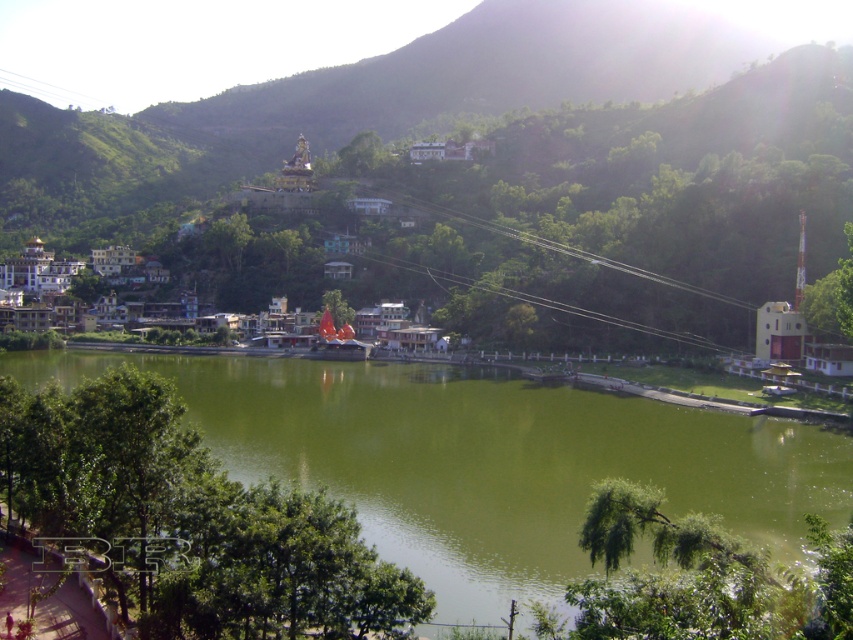
Is point (781, 442) positioned in front of point (199, 323)?

That is True.

Between green water at center and white stucco buildings at center, which one has less height?

Standing shorter between the two is green water at center.

Which is in front, point (538, 483) or point (434, 349)?

Point (538, 483) is more forward.

Locate an element on the screen. Image resolution: width=853 pixels, height=640 pixels. green water at center is located at coordinates (485, 460).